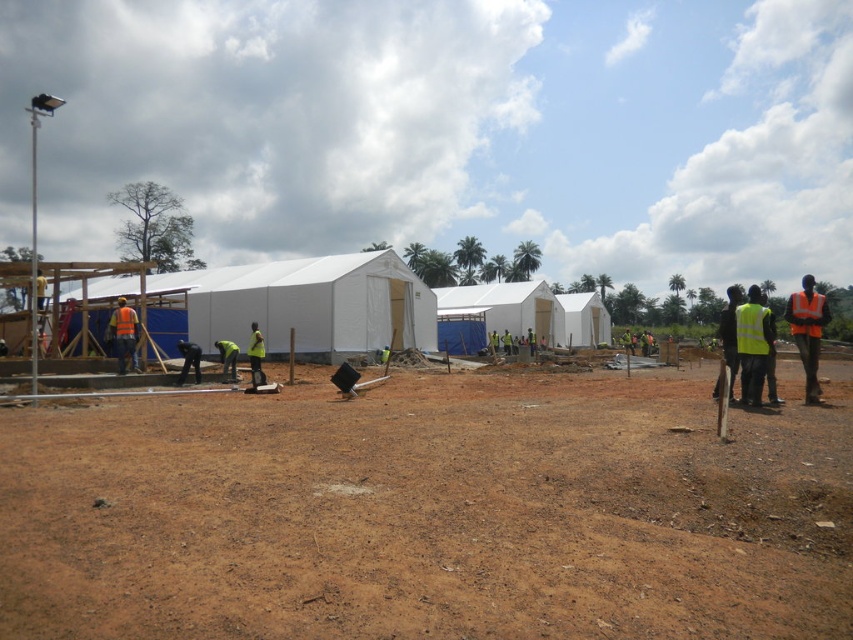
Between brown sandy dirt at lower center and high visibility yellow vest at right, which one has more height?

Standing taller between the two is high visibility yellow vest at right.

Can you confirm if brown sandy dirt at lower center is wider than high visibility yellow vest at right?

Yes, brown sandy dirt at lower center is wider than high visibility yellow vest at right.

The width and height of the screenshot is (853, 640). Identify the location of brown sandy dirt at lower center. (428, 513).

Who is lower down, high visibility yellow vest at right or orange reflective safety vest at left?

orange reflective safety vest at left is below.

Is high visibility yellow vest at right thinner than orange reflective safety vest at left?

No.

Describe the element at coordinates (807, 332) in the screenshot. I see `high visibility yellow vest at right` at that location.

Locate an element on the screen. high visibility yellow vest at right is located at coordinates (807, 332).

Describe the element at coordinates (807, 332) in the screenshot. Image resolution: width=853 pixels, height=640 pixels. I see `high visibility yellow vest at right` at that location.

Identify the location of high visibility yellow vest at right. The width and height of the screenshot is (853, 640). (807, 332).